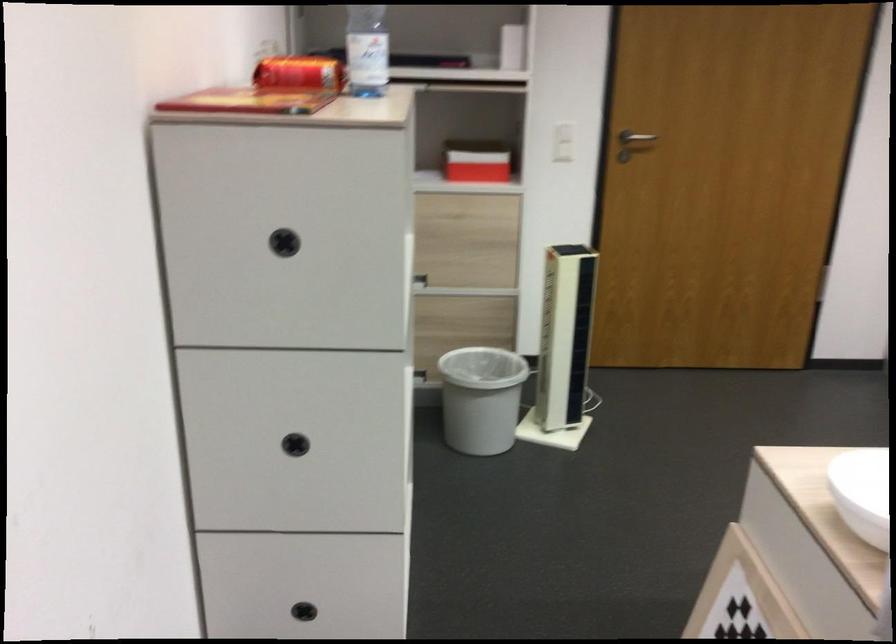
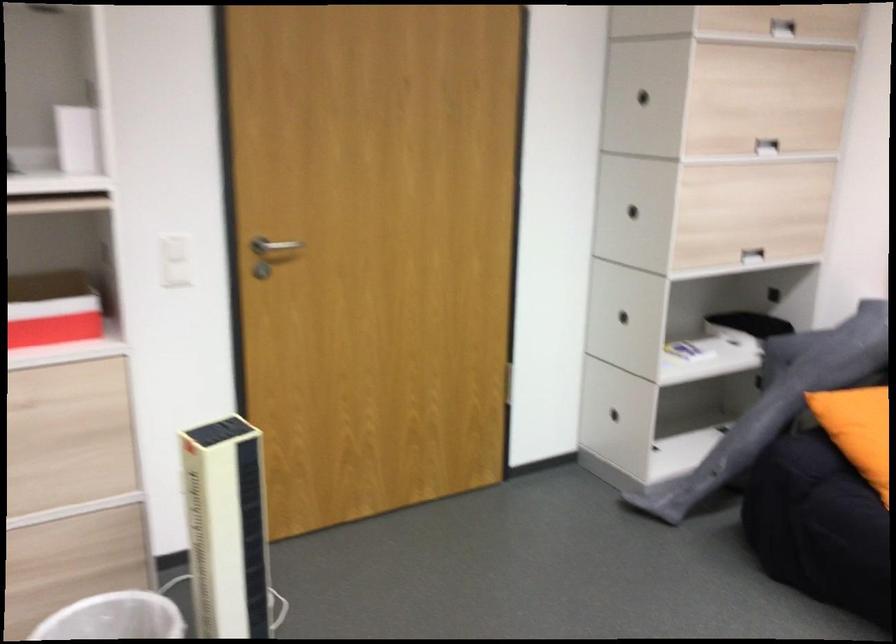
Question: The images are taken continuously from a first-person perspective. In which direction are you moving?

Choices:
 (A) Left
 (B) Right
 (C) Forward
 (D) Backward

Answer: (C)